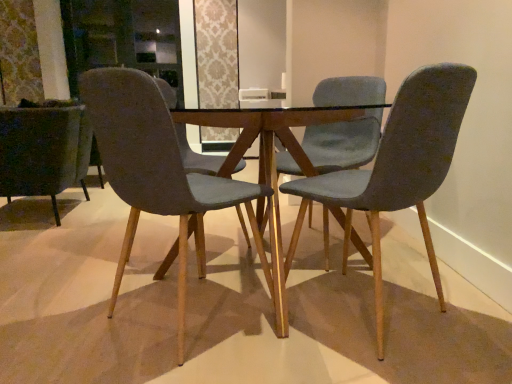
Question: Considering the positions of velvet dark green armchair at left, which is the 4th chair in right-to-left order, and velvet grey chair at center, the 2th chair from the left, in the image, is velvet dark green armchair at left, which is the 4th chair in right-to-left order, bigger or smaller than velvet grey chair at center, the 2th chair from the left,?

Choices:
 (A) big
 (B) small

Answer: (A)

Question: Considering the positions of velvet dark green armchair at left, marked as the first chair in a left-to-right arrangement, and velvet grey chair at center, which is the third chair in right-to-left order, in the image, is velvet dark green armchair at left, marked as the first chair in a left-to-right arrangement, wider or thinner than velvet grey chair at center, which is the third chair in right-to-left order,?

Choices:
 (A) wide
 (B) thin

Answer: (A)

Question: Based on their relative distances, which object is nearer to the velvet grey chair at center, the 2th chair from the left?

Choices:
 (A) velvet grey chair at right, which appears as the first chair when viewed from the right
 (B) velvet teal chair at center, the 3th chair when ordered from left to right
 (C) velvet dark green armchair at left, which is the 4th chair in right-to-left order

Answer: (A)

Question: Which object is the farthest from the velvet grey chair at center, which is the third chair in right-to-left order?

Choices:
 (A) velvet dark green armchair at left, which is the 4th chair in right-to-left order
 (B) velvet teal chair at center, the 3th chair when ordered from left to right
 (C) velvet grey chair at right, which appears as the first chair when viewed from the right

Answer: (A)